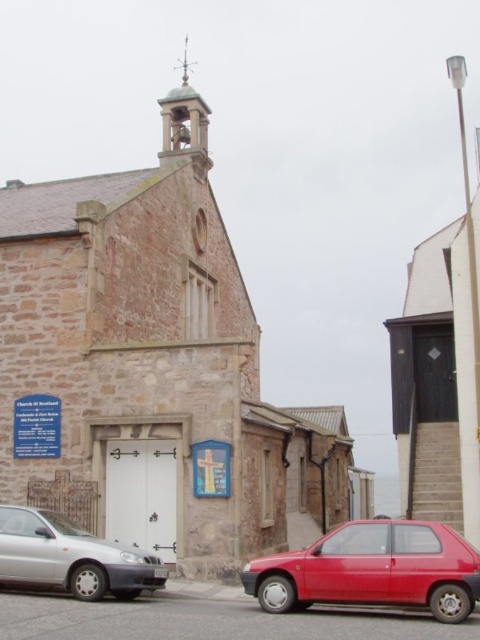
Measure the distance between shiny red car at lower right and metallic bell tower at upper center.

The distance of shiny red car at lower right from metallic bell tower at upper center is 46.15 meters.

Is shiny red car at lower right to the left of metallic bell tower at upper center from the viewer's perspective?

Incorrect, shiny red car at lower right is not on the left side of metallic bell tower at upper center.

Identify the location of shiny red car at lower right. The height and width of the screenshot is (640, 480). (372, 570).

Where is `shiny red car at lower right`? shiny red car at lower right is located at coordinates (372, 570).

Is stone church at center above silver metallic car at lower left?

Yes.

Is stone church at center bigger than silver metallic car at lower left?

Correct, stone church at center is larger in size than silver metallic car at lower left.

This screenshot has width=480, height=640. What do you see at coordinates (151, 376) in the screenshot?
I see `stone church at center` at bounding box center [151, 376].

Find the location of a particular element. stone church at center is located at coordinates (151, 376).

From the picture: Between silver metallic car at lower left and metallic bell tower at upper center, which one is positioned higher?

metallic bell tower at upper center is higher up.

Is point (110, 557) positioned before point (205, 112)?

Yes, it is in front of point (205, 112).

What do you see at coordinates (72, 556) in the screenshot?
I see `silver metallic car at lower left` at bounding box center [72, 556].

This screenshot has height=640, width=480. In order to click on silver metallic car at lower left in this screenshot , I will do `click(72, 556)`.